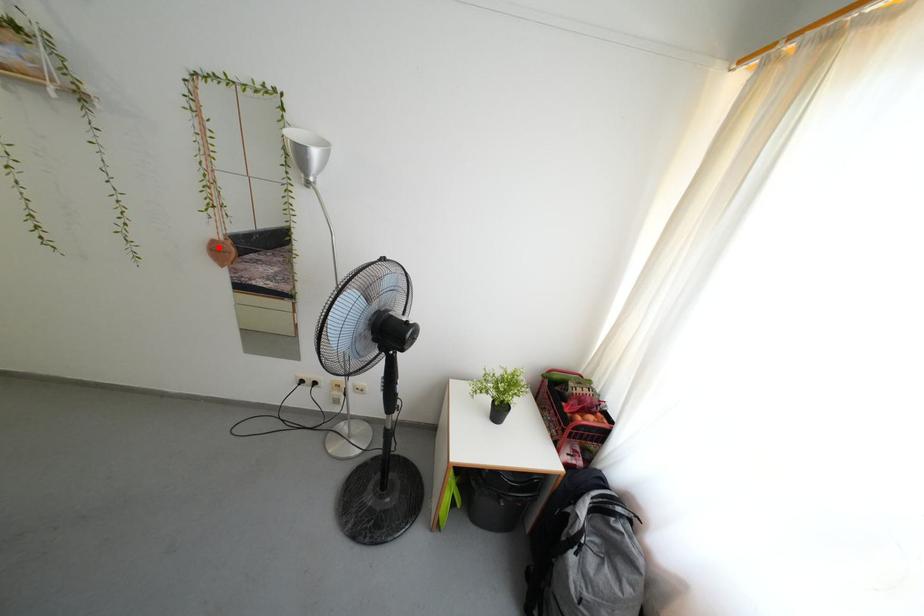
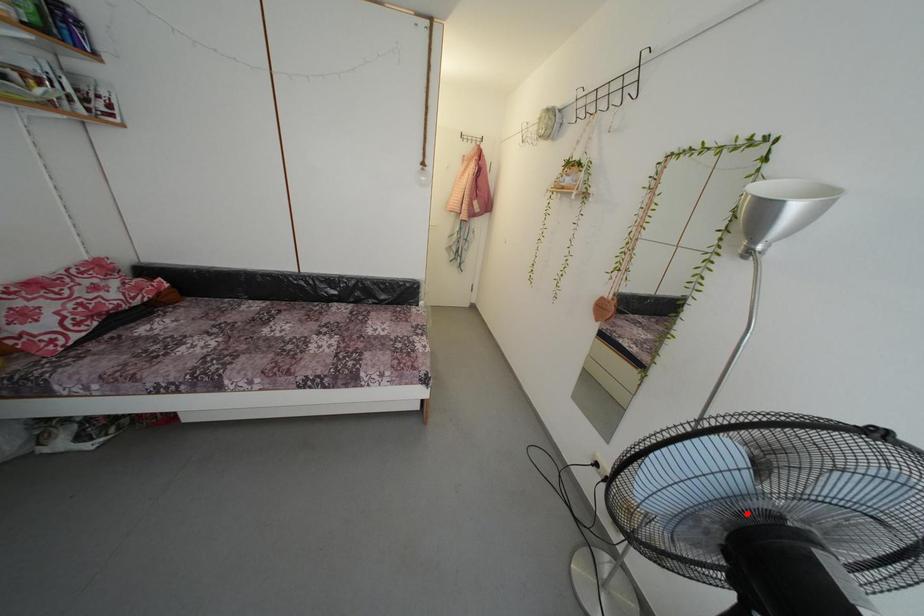
I am providing you with two images of the same scene from different viewpoints. A red point is marked on the first image and another point is marked on the second image. Is the red point in image1 aligned with the point shown in image2?

No